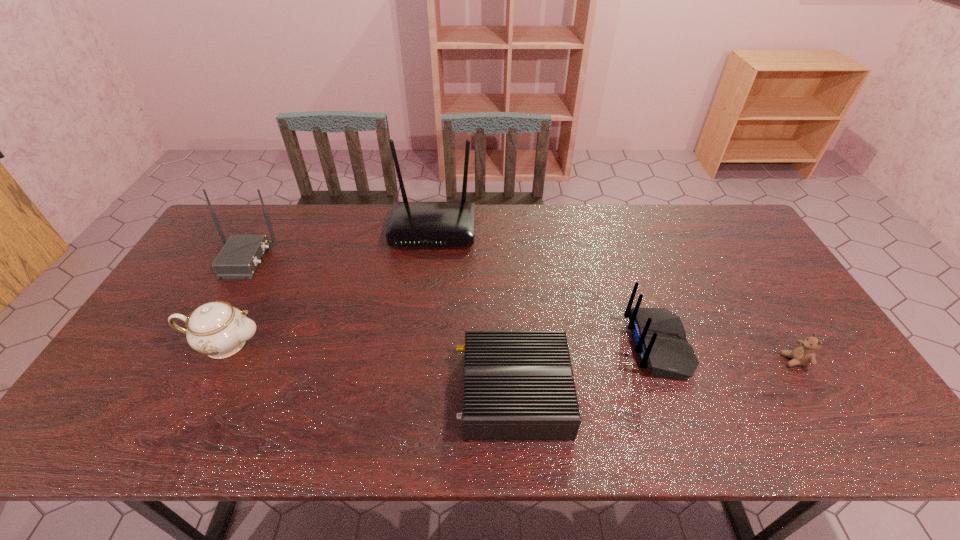
This screenshot has width=960, height=540. In order to click on object that ranks as the third closest to the fifth object from left to right in this screenshot , I will do `click(411, 224)`.

Select which object appears as the fourth closest to the chinaware. Please provide its 2D coordinates. Your answer should be formatted as a tuple, i.e. [(x, y)], where the tuple contains the x and y coordinates of a point satisfying the conditions above.

[(659, 337)]

Image resolution: width=960 pixels, height=540 pixels. Identify the location of the fourth closest router to the rightmost object. (239, 258).

The image size is (960, 540). In order to click on router object that ranks as the closest to the tallest object in this screenshot , I will do pos(239,258).

This screenshot has width=960, height=540. What are the coordinates of `vacant point that satisfies the following two spatial constraints: 1. on the front-facing side of the tallest object; 2. on the back of the leftmost router to connect cables` in the screenshot? It's located at (429, 259).